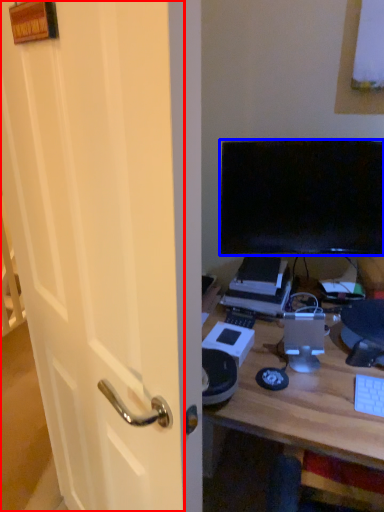
Question: Which object appears farthest to the camera in this image, glass door (highlighted by a red box) or television (highlighted by a blue box)?

Choices:
 (A) glass door
 (B) television

Answer: (B)